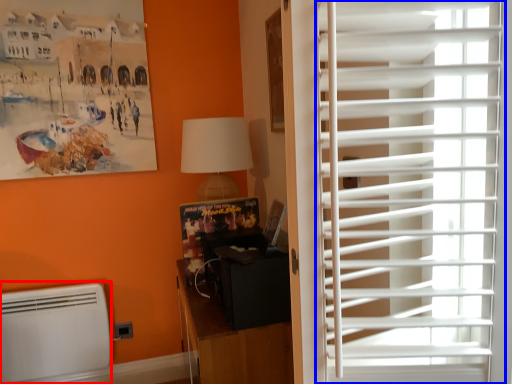
Question: Among these objects, which one is nearest to the camera, air conditioning (highlighted by a red box) or window blind (highlighted by a blue box)?

Choices:
 (A) air conditioning
 (B) window blind

Answer: (B)